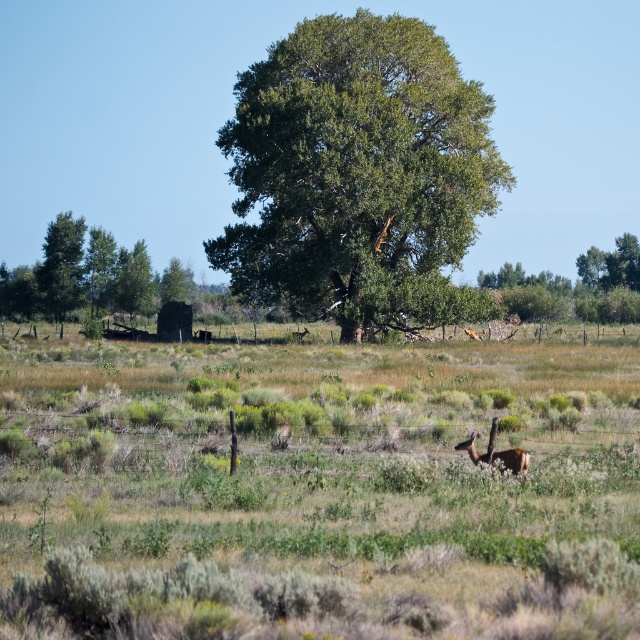
Question: Which object is closer to the camera taking this photo?

Choices:
 (A) brown furry antelope at center
 (B) green leafy oak tree at center
 (C) green leafy tree at upper left

Answer: (A)

Question: From the image, what is the correct spatial relationship of green leafy tree at left in relation to green leafy tree at upper center?

Choices:
 (A) left
 (B) right

Answer: (A)

Question: Which of the following is the farthest from the observer?

Choices:
 (A) (620, 312)
 (B) (504, 452)
 (C) (51, 253)

Answer: (A)

Question: Does green leafy tree at upper center have a larger size compared to green leafy tree at upper left?

Choices:
 (A) no
 (B) yes

Answer: (B)

Question: Which point is farther to the camera?

Choices:
 (A) (186, 280)
 (B) (42, 266)
 (C) (384, 188)
 (D) (630, 310)

Answer: (A)

Question: Is green leafy oak tree at center to the right of green leafy tree at upper left from the viewer's perspective?

Choices:
 (A) yes
 (B) no

Answer: (A)